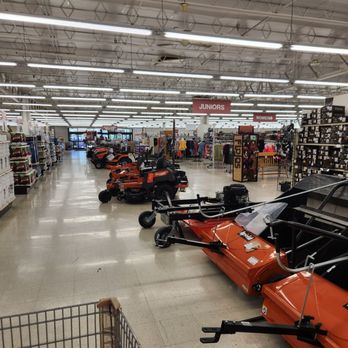
At what (x,y) coordinates should I click in order to perform the action: click on wall to the side of the door. Please return your answer as a coordinate pair (x, y). Looking at the image, I should click on (61, 132).